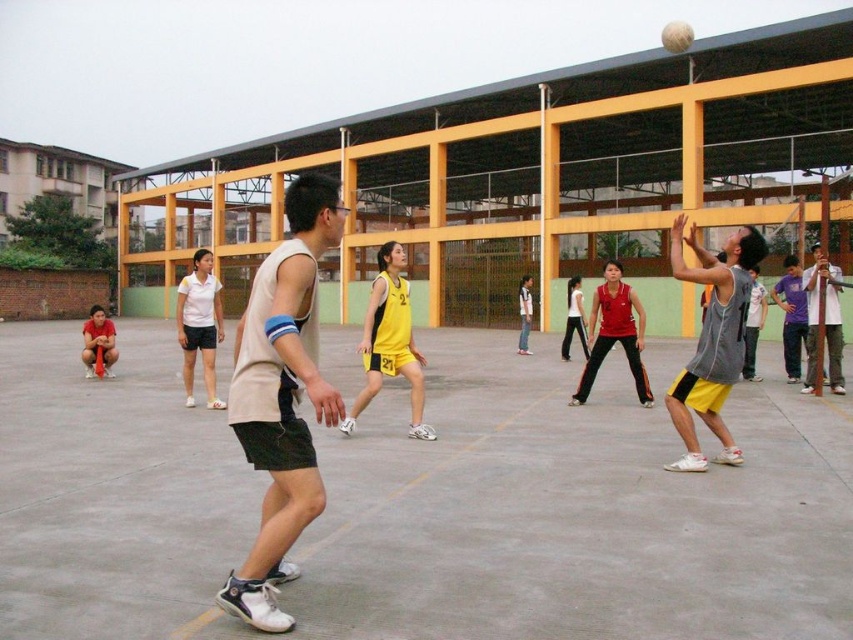
Which is in front, point (819, 248) or point (691, 42)?

Positioned in front is point (819, 248).

Who is lower down, gray fabric shirt at center or white matte basketball at center?

Positioned lower is gray fabric shirt at center.

Which is in front, point (817, 282) or point (665, 44)?

Point (817, 282)

At what (x,y) coordinates should I click in order to perform the action: click on gray fabric shirt at center. Please return your answer as a coordinate pair (x, y). Image resolution: width=853 pixels, height=640 pixels. Looking at the image, I should click on (822, 320).

Measure the distance between light beige sleeveless shirt at center and gray fabric shirt at center.

They are 9.77 meters apart.

Can you confirm if light beige sleeveless shirt at center is positioned below gray fabric shirt at center?

Yes, light beige sleeveless shirt at center is below gray fabric shirt at center.

Locate an element on the screen. light beige sleeveless shirt at center is located at coordinates (282, 397).

Is point (134, 508) closer to viewer compared to point (804, 381)?

Yes.

Which of these two, gray concrete basketball court at center or gray fabric shirt at center, stands shorter?

gray concrete basketball court at center is shorter.

Between point (438, 564) and point (817, 284), which one is positioned behind?

The point (817, 284) is more distant.

I want to click on gray concrete basketball court at center, so click(x=575, y=515).